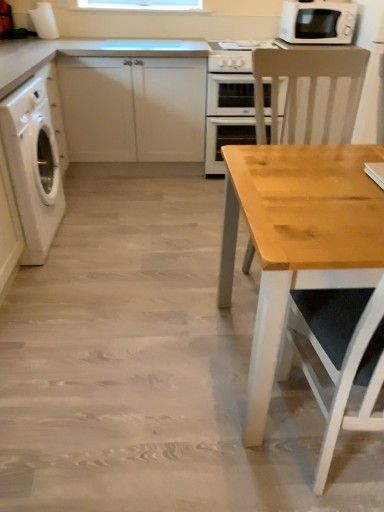
I want to click on light wood chair at right, so click(x=310, y=85).

Image resolution: width=384 pixels, height=512 pixels. Describe the element at coordinates (228, 116) in the screenshot. I see `white glossy oven at center` at that location.

Looking at this image, what is the approximate height of white glossy gas stove at upper center?

The height of white glossy gas stove at upper center is 8.26 inches.

You are a GUI agent. You are given a task and a screenshot of the screen. Output one action in this format:
    pyautogui.click(x=<x>, y=<y>)
    Task: Click on the natural wood table at right
    The height and width of the screenshot is (512, 384).
    Given the screenshot: What is the action you would take?
    pyautogui.click(x=153, y=370)

Locate an element on the screen. The width and height of the screenshot is (384, 512). beige plastic microwave at upper right is located at coordinates (318, 22).

Locate an element on the screen. The image size is (384, 512). light wood chair at right is located at coordinates (310, 85).

From a real-world perspective, which object rests below the other?

From a 3D spatial view, white matte cabinet at left is below.

Could you tell me if white glossy gas stove at upper center is facing white matte cabinet at left?

No, white glossy gas stove at upper center is not aimed at white matte cabinet at left.

In terms of size, does white glossy gas stove at upper center appear bigger or smaller than white matte cabinet at left?

Clearly, white glossy gas stove at upper center is smaller in size than white matte cabinet at left.

Can you confirm if white glossy gas stove at upper center is wider than white matte cabinet at left?

No.

Based on the photo, who is bigger, beige plastic microwave at upper right or white matte cabinet at left?

Bigger between the two is white matte cabinet at left.

In the scene shown: From a real-world perspective, which object rests below the other?

white matte cabinet at left, from a real-world perspective.

Considering the positions of objects beige plastic microwave at upper right and white matte cabinet at left in the image provided, who is more to the right, beige plastic microwave at upper right or white matte cabinet at left?

beige plastic microwave at upper right is more to the right.

Is white matte cabinet at left at the back of beige plastic microwave at upper right?

beige plastic microwave at upper right does not have its back to white matte cabinet at left.

Considering the points (285, 40) and (49, 113), which point is in front, point (285, 40) or point (49, 113)?

The point (49, 113) is in front.

You are a GUI agent. You are given a task and a screenshot of the screen. Output one action in this format:
    pyautogui.click(x=<x>, y=<y>)
    Task: Click on the microwave oven above the white glossy washing machine at left (from the image's perspective)
    This screenshot has height=512, width=384.
    Given the screenshot: What is the action you would take?
    pyautogui.click(x=318, y=22)

Does beige plastic microwave at upper right have a greater width compared to white glossy washing machine at left?

Incorrect, the width of beige plastic microwave at upper right does not surpass that of white glossy washing machine at left.

From the image's perspective, does beige plastic microwave at upper right appear higher than white glossy washing machine at left?

Yes.

Is beige plastic microwave at upper right closer to camera compared to light wood chair at right?

No, it is not.

Locate an element on the screen. The image size is (384, 512). microwave oven located on the right of light wood chair at right is located at coordinates (318, 22).

Considering the relative sizes of beige plastic microwave at upper right and light wood chair at right in the image provided, is beige plastic microwave at upper right bigger than light wood chair at right?

Actually, beige plastic microwave at upper right might be smaller than light wood chair at right.

Does white glossy oven at center have a smaller size compared to white glossy washing machine at left?

No.

Visually, is white glossy oven at center positioned to the left or to the right of white glossy washing machine at left?

white glossy oven at center is to the right of white glossy washing machine at left.

You are a GUI agent. You are given a task and a screenshot of the screen. Output one action in this format:
    pyautogui.click(x=<x>, y=<y>)
    Task: Click on the oven on the right of white glossy washing machine at left
    This screenshot has height=512, width=384.
    Given the screenshot: What is the action you would take?
    pyautogui.click(x=228, y=116)

How far apart are white glossy oven at center and white glossy washing machine at left?

white glossy oven at center is 1.35 meters away from white glossy washing machine at left.

Can you confirm if natural wood table at right is positioned to the right of light wood chair at right?

Incorrect, natural wood table at right is not on the right side of light wood chair at right.

Considering the relative sizes of natural wood table at right and light wood chair at right in the image provided, is natural wood table at right thinner than light wood chair at right?

No, natural wood table at right is not thinner than light wood chair at right.

From a real-world perspective, which is physically above, natural wood table at right or light wood chair at right?

From a 3D spatial view, light wood chair at right is above.

Between white matte cabinet at left and white glossy oven at center, which one has larger size?

white matte cabinet at left is bigger.

Can you tell me how much white matte cabinet at left and white glossy oven at center differ in facing direction?

The angular difference between white matte cabinet at left and white glossy oven at center is 0.000118 degrees.

At what (x,y) coordinates should I click in order to perform the action: click on cabinetry lying in front of the white glossy oven at center. Please return your answer as a coordinate pair (x, y). The image size is (384, 512). Looking at the image, I should click on (133, 108).

From the image's perspective, which is above, white matte cabinet at left or white glossy oven at center?

white matte cabinet at left, from the image's perspective.

This screenshot has width=384, height=512. I want to click on gas stove above the white matte cabinet at left (from the image's perspective), so click(x=234, y=55).

In order to click on cabinetry that is on the left side of beige plastic microwave at upper right in this screenshot , I will do `click(133, 108)`.

Based on their spatial positions, is white glossy washing machine at left or white matte cabinet at left closer to light wood chair at right?

white matte cabinet at left lies closer to light wood chair at right than the other object.

Based on their spatial positions, is white glossy washing machine at left or natural wood table at right closer to white glossy gas stove at upper center?

The object closer to white glossy gas stove at upper center is white glossy washing machine at left.

Considering their positions, is white glossy oven at center positioned further to beige plastic microwave at upper right than white matte cabinet at left?

white matte cabinet at left lies further to beige plastic microwave at upper right than the other object.

Which object lies nearer to the anchor point white glossy gas stove at upper center, beige plastic microwave at upper right or light wood chair at right?

beige plastic microwave at upper right is closer to white glossy gas stove at upper center.

When comparing their distances from white glossy washing machine at left, does white matte cabinet at left or white glossy gas stove at upper center seem closer?

white matte cabinet at left.

Based on their spatial positions, is white matte cabinet at left or beige plastic microwave at upper right closer to light wood chair at right?

beige plastic microwave at upper right lies closer to light wood chair at right than the other object.

Which object lies nearer to the anchor point natural wood table at right, beige plastic microwave at upper right or light wood chair at right?

The object closer to natural wood table at right is light wood chair at right.

Based on their spatial positions, is beige plastic microwave at upper right or white glossy washing machine at left further from white glossy oven at center?

white glossy washing machine at left.

Where is `oven located between white glossy washing machine at left and light wood chair at right in the left-right direction`? The image size is (384, 512). oven located between white glossy washing machine at left and light wood chair at right in the left-right direction is located at coordinates (228, 116).

Identify the location of cabinetry between light wood chair at right and white glossy oven at center from front to back. This screenshot has width=384, height=512. (133, 108).

Locate an element on the screen. Image resolution: width=384 pixels, height=512 pixels. oven between white glossy washing machine at left and beige plastic microwave at upper right from left to right is located at coordinates (228, 116).

The image size is (384, 512). Identify the location of microwave oven between light wood chair at right and white glossy oven at center in the front-back direction. (318, 22).